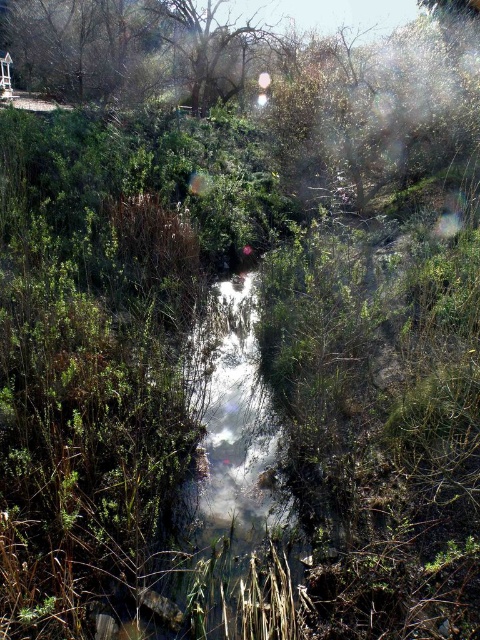
You are standing in the middle of the stream and want to reach the green leafy tree at upper center. Which direction should you walk to get there?

You should walk towards the upper center direction to reach the green leafy tree at upper center, as it is located at point (x=377, y=106).

Looking at this image, you are standing at the edge of the stream and notice two trees at the upper center of your view. Which tree is closer to you, the green leafy tree at upper center or the brown textured tree at upper center?

The green leafy tree at upper center is closer to you because it is in front of the brown textured tree at upper center.

From the picture: You are a hiker standing at the edge of the stream and looking up at the trees. Which tree is closer to the ground between the green leafy tree at upper center and the brown textured tree at upper center?

The green leafy tree at upper center is closer to the ground because it is positioned below the brown textured tree at upper center.